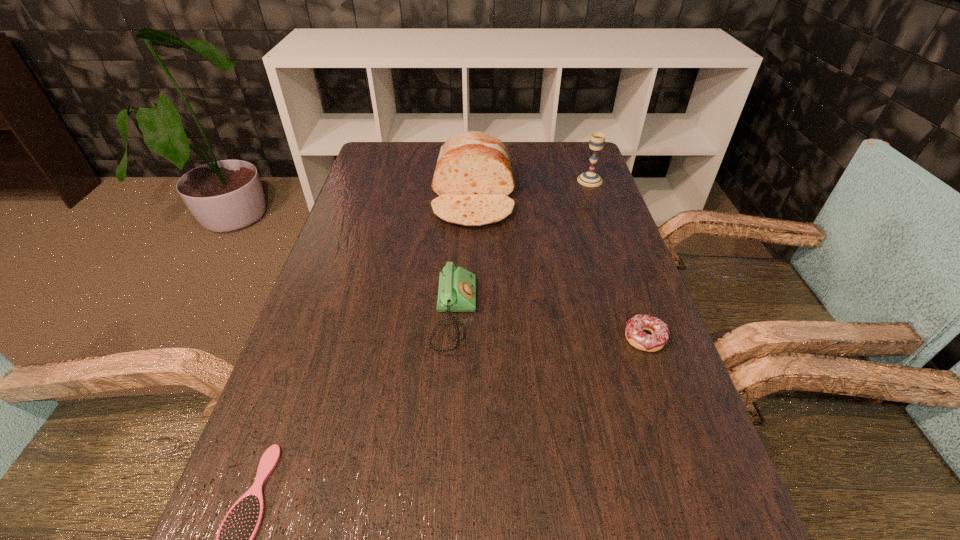
What are the coordinates of `chalice that is at the right edge` in the screenshot? It's located at (591, 179).

In order to click on doughnut that is at the right edge in this screenshot , I will do `click(634, 333)`.

In order to click on object at the far right corner in this screenshot , I will do `click(591, 179)`.

The width and height of the screenshot is (960, 540). In the image, there is a desktop. Find the location of `vacant space at the far edge`. vacant space at the far edge is located at coordinates (412, 172).

Where is `free space at the left edge`? Image resolution: width=960 pixels, height=540 pixels. free space at the left edge is located at coordinates (401, 207).

Where is `vacant space at the right edge of the desktop`? This screenshot has height=540, width=960. vacant space at the right edge of the desktop is located at coordinates (572, 238).

Where is `vacant space at the far right corner of the desktop`? This screenshot has width=960, height=540. vacant space at the far right corner of the desktop is located at coordinates coord(557,156).

You are a GUI agent. You are given a task and a screenshot of the screen. Output one action in this format:
    pyautogui.click(x=<x>, y=<y>)
    Task: Click on the free spot between the doughnut and the third shortest object
    This screenshot has height=540, width=960.
    Given the screenshot: What is the action you would take?
    pyautogui.click(x=549, y=327)

Image resolution: width=960 pixels, height=540 pixels. In order to click on free space between the third shortest object and the chalice in this screenshot , I will do tap(522, 248).

Locate an element on the screen. This screenshot has height=540, width=960. vacant region between the fourth tallest object and the chalice is located at coordinates (617, 259).